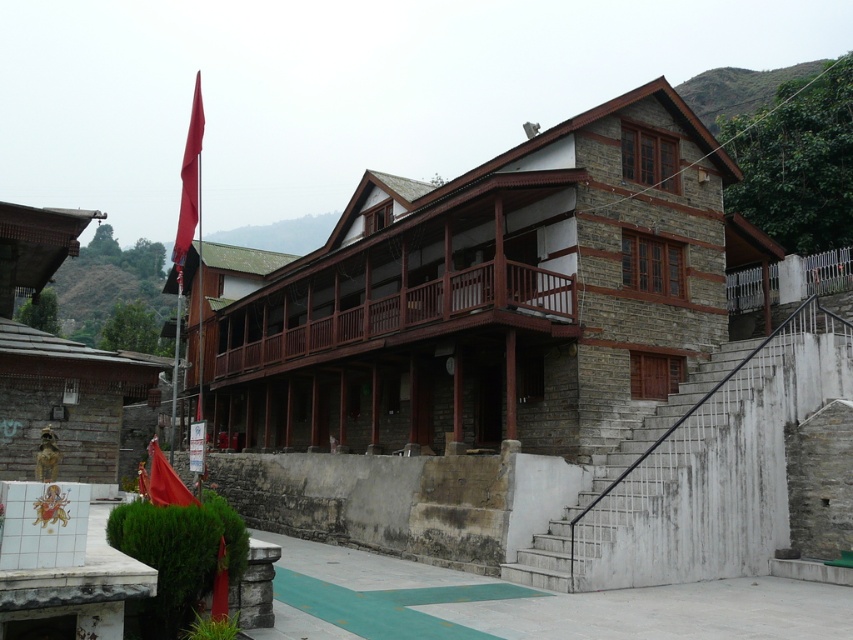
Is white concrete stairs at center shorter than red fabric flag at upper left?

Yes.

Is point (816, 326) closer to camera compared to point (184, 163)?

Yes, point (816, 326) is in front of point (184, 163).

Locate an element on the screen. white concrete stairs at center is located at coordinates (700, 470).

Does red fabric flag at upper left have a greater width compared to shiny red flag at lower left?

Indeed, red fabric flag at upper left has a greater width compared to shiny red flag at lower left.

Is point (183, 244) closer to viewer compared to point (160, 452)?

No.

This screenshot has width=853, height=640. What do you see at coordinates (189, 180) in the screenshot?
I see `red fabric flag at upper left` at bounding box center [189, 180].

Locate an element on the screen. This screenshot has height=640, width=853. red fabric flag at upper left is located at coordinates (189, 180).

Based on the photo, can you confirm if white concrete stairs at center is shorter than shiny red flag at lower left?

Correct, white concrete stairs at center is not as tall as shiny red flag at lower left.

The image size is (853, 640). In order to click on white concrete stairs at center in this screenshot , I will do `click(700, 470)`.